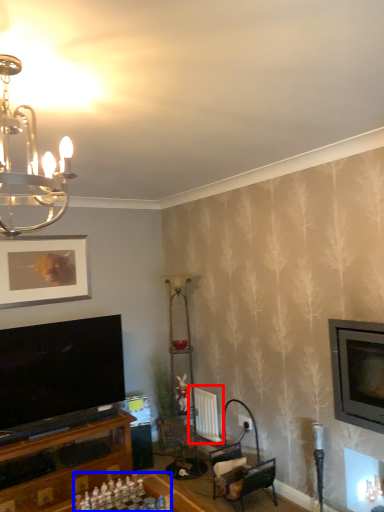
Question: Which object appears closest to the camera in this image, radiator (highlighted by a red box) or board game (highlighted by a blue box)?

Choices:
 (A) radiator
 (B) board game

Answer: (B)